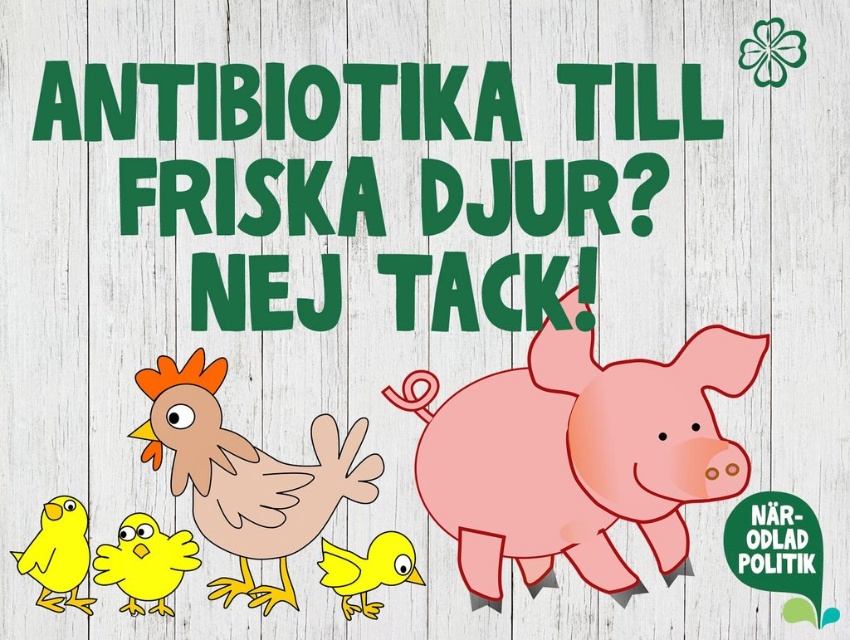
Question: Can you confirm if matte yellow chick at lower left is bigger than matte yellow bird at center?

Choices:
 (A) yes
 (B) no

Answer: (A)

Question: Which point appears closest to the camera in this image?

Choices:
 (A) (162, 600)
 (B) (675, 444)
 (C) (337, 579)
 (D) (44, 540)

Answer: (D)

Question: Can you confirm if pink matte pig at center is positioned above matte yellow bird at center?

Choices:
 (A) yes
 (B) no

Answer: (A)

Question: Considering the relative positions of matte yellow chick at lower left and matte yellow bird at lower left in the image provided, where is matte yellow chick at lower left located with respect to matte yellow bird at lower left?

Choices:
 (A) below
 (B) above

Answer: (A)

Question: Which point is farther to the camera?

Choices:
 (A) pink matte pig at center
 (B) matte yellow bird at center
 (C) brown matte chicken at center

Answer: (A)

Question: Which point appears farthest from the camera in this image?

Choices:
 (A) (157, 410)
 (B) (570, 540)
 (C) (350, 584)
 (D) (83, 570)

Answer: (B)